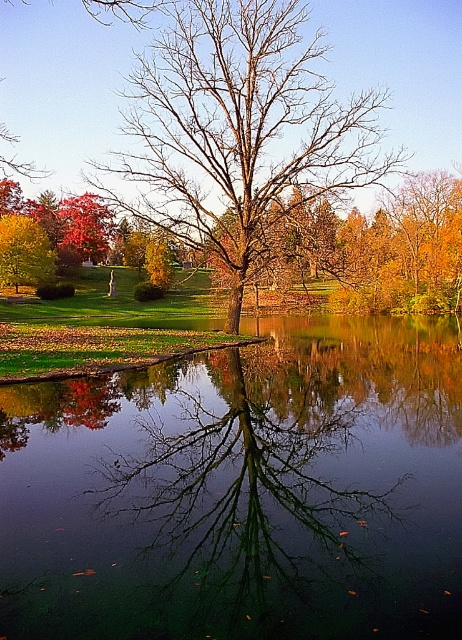
From the picture: You are planning to place a small wooden boat in the image. The boat requires a space wider than the bare wood tree at center to navigate safely. Can the green reflective water at center accommodate the boat?

The green reflective water at center has a width less than the bare wood tree at center, so it cannot accommodate the boat which needs a space wider than the tree.